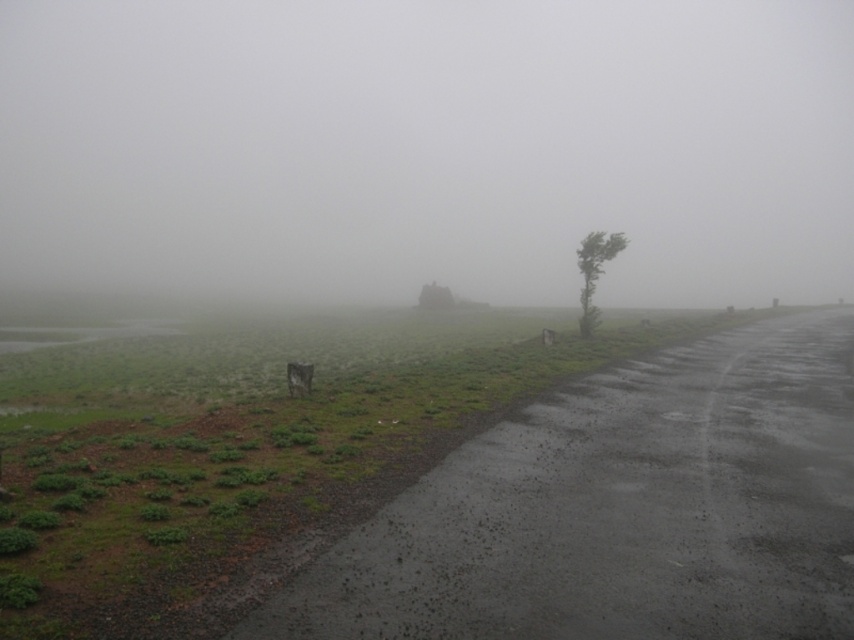
Question: Is foggy atmosphere at center above green leafy tree at right?

Choices:
 (A) yes
 (B) no

Answer: (A)

Question: Is foggy atmosphere at center above green leafy tree at right?

Choices:
 (A) no
 (B) yes

Answer: (B)

Question: Which point appears closest to the camera in this image?

Choices:
 (A) (560, 252)
 (B) (589, 262)

Answer: (B)

Question: Is foggy atmosphere at center to the right of green leafy tree at right from the viewer's perspective?

Choices:
 (A) no
 (B) yes

Answer: (B)